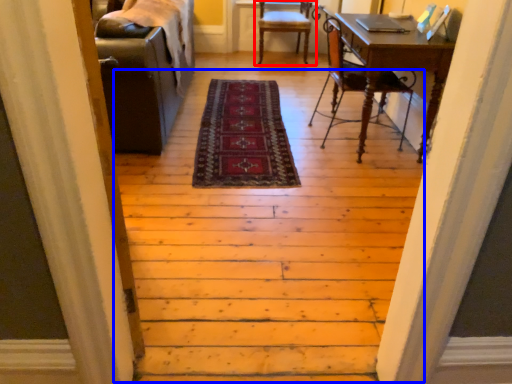
Question: Which object appears closest to the camera in this image, chair (highlighted by a red box) or stairwell (highlighted by a blue box)?

Choices:
 (A) chair
 (B) stairwell

Answer: (B)